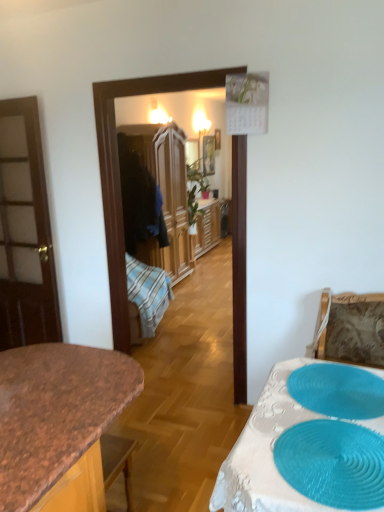
At what (x,y) coordinates should I click in order to perform the action: click on vacant region to the left of blue textured placemat at lower right, which ranks as the first oval in back-to-front order. Please return your answer as a coordinate pair (x, y). This screenshot has height=512, width=384. Looking at the image, I should click on (274, 410).